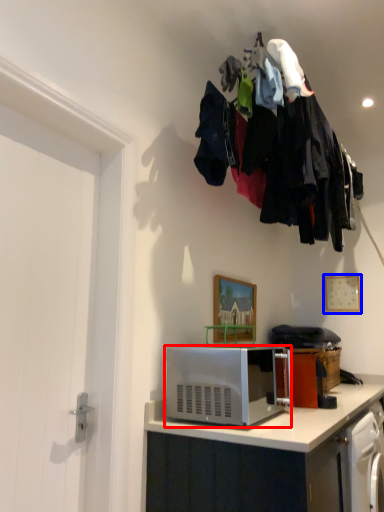
Question: Which object is closer to the camera taking this photo, microwave oven (highlighted by a red box) or picture frame (highlighted by a blue box)?

Choices:
 (A) microwave oven
 (B) picture frame

Answer: (A)